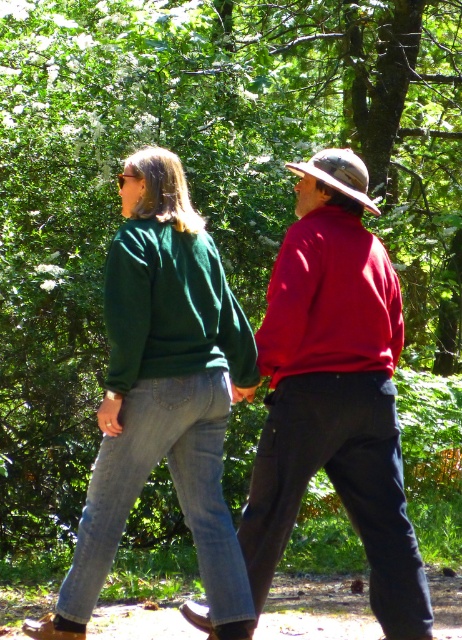
Is matte red sweater at center to the right of green fleece sweater at center from the viewer's perspective?

Yes, matte red sweater at center is to the right of green fleece sweater at center.

At what (x,y) coordinates should I click in order to perform the action: click on matte red sweater at center. Please return your answer as a coordinate pair (x, y). The height and width of the screenshot is (640, 462). Looking at the image, I should click on (334, 392).

Image resolution: width=462 pixels, height=640 pixels. Find the location of `matte red sweater at center`. matte red sweater at center is located at coordinates (334, 392).

The image size is (462, 640). What are the coordinates of `matte red sweater at center` in the screenshot? It's located at (334, 392).

Which is below, matte green sweater at center or green fleece sweater at center?

matte green sweater at center is below.

Between point (208, 604) and point (132, 371), which one is positioned in front?

Point (132, 371)

Is point (236, 332) more distant than point (150, 339)?

Yes.

This screenshot has width=462, height=640. Identify the location of matte green sweater at center. (164, 396).

Does matte red sweater at center have a larger size compared to matte green sweater at center?

No.

What do you see at coordinates (334, 392) in the screenshot? The width and height of the screenshot is (462, 640). I see `matte red sweater at center` at bounding box center [334, 392].

Locate an element on the screen. matte red sweater at center is located at coordinates (334, 392).